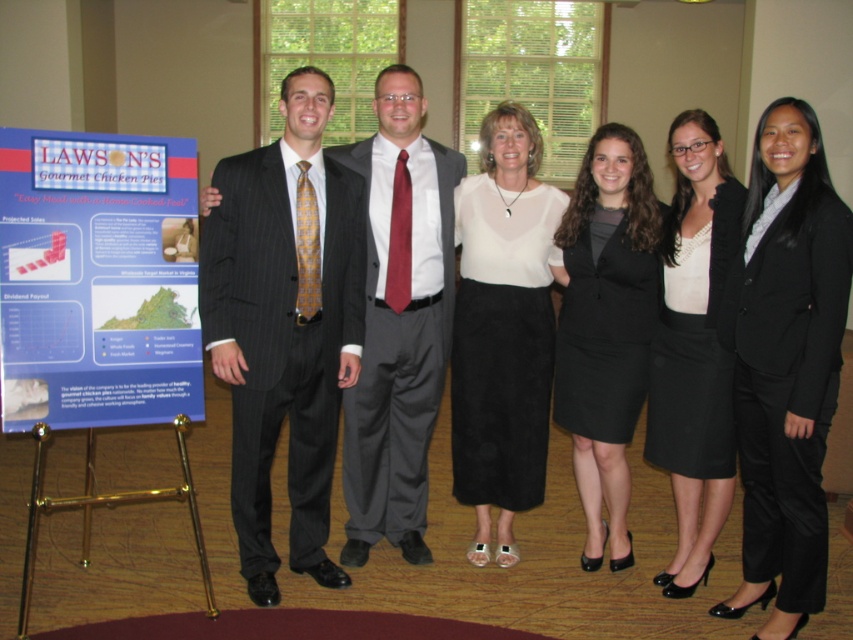
You are a photographer adjusting your camera settings. You notice the pinstripe suit at center in the image. Based on its position, can you determine if it will be in the center of the frame?

The pinstripe suit at center is located at point coordinates (x=281, y=342), which is slightly offset from the exact center of the frame. Therefore, it is not perfectly centered but close to the center area.

What is the exact coordinate of the blue paperboard poster at left in the image?

The blue paperboard poster at left is located at coordinate point (x=97, y=280).

You are a photographer adjusting the camera settings for a group photo. You notice two key elements in the frame that need to be in focus simultaneously. The first is the pinstripe suit at center, and the second is the white suede skirt at center. Since the camera can only focus on one subject at a time, you need to determine which of these two elements is closer to the camera to prioritize focus. Based on the scene described, which element is closer?

The pinstripe suit at center is closer to the camera because it has a lesser height compared to the white suede skirt at center, indicating it is positioned in front.